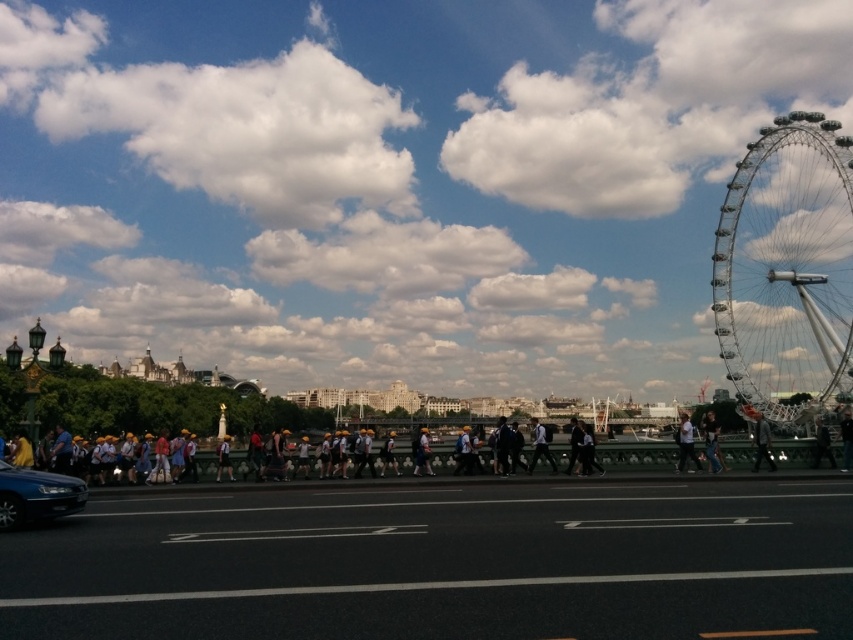
You are standing on the bridge and want to take a photo of both the point at coordinates [722,205] and the point at coordinates [712,461]. Which point should you focus on first to ensure both are in focus?

You should focus on the point at coordinates [722,205] first because it is closer to the camera than the point at coordinates [712,461]. This ensures both points will be in focus as the closer point sets the focal plane.

You are a photographer trying to capture both the dark gray suit at center and the light brown leather jacket at center in a single frame. Which clothing item should you focus on first to ensure both are in the frame, considering their sizes?

The dark gray suit at center is larger in size compared to the light brown leather jacket at center, so you should focus on the dark gray suit at center first to ensure it fits within the frame while also capturing the smaller light brown leather jacket at center.

In the scene shown: You are standing on the bridge and want to take a photo of both the silver metallic ferris wheel at right and the denim jacket at center. Which object should you focus on first to ensure both are in the frame?

You should focus on the silver metallic ferris wheel at right first because it is closer to you than the denim jacket at center, so adjusting the camera to include it will also capture the denim jacket at center in the background.